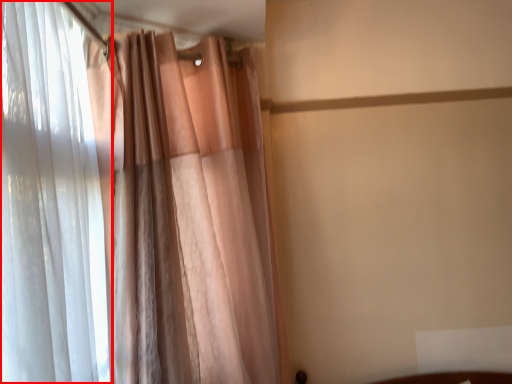
Question: From the image's perspective, what is the correct spatial positioning of curtain (annotated by the red box) in reference to curtain?

Choices:
 (A) above
 (B) below

Answer: (A)